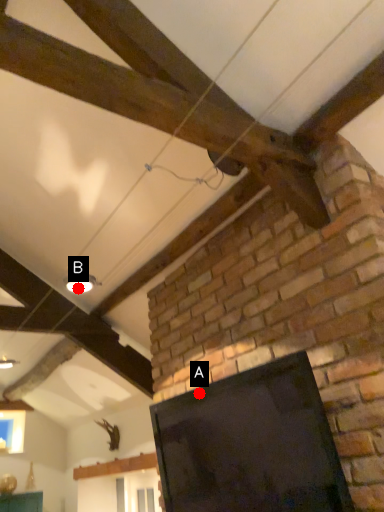
Question: Two points are circled on the image, labeled by A and B beside each circle. Among these points, which one is farthest from the camera?

Choices:
 (A) A is further
 (B) B is further

Answer: (B)